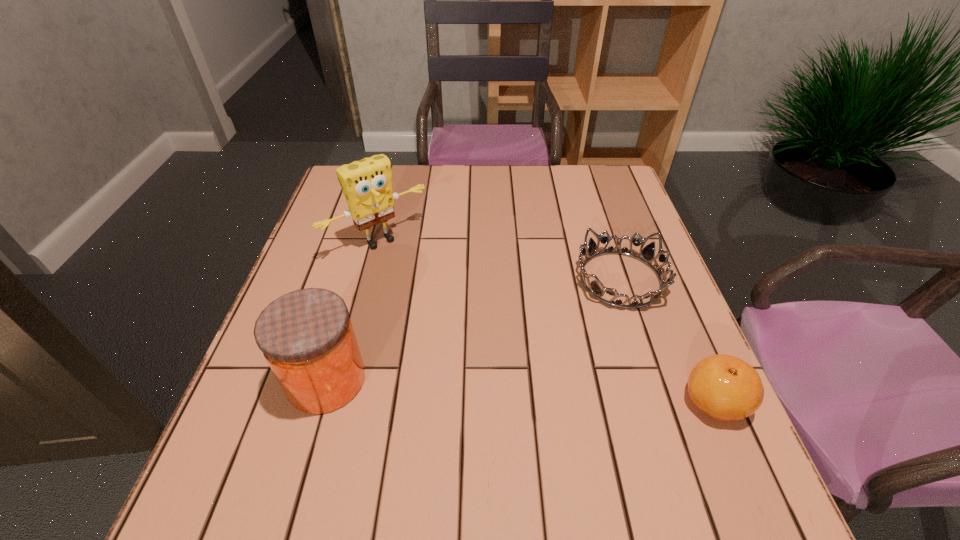
Locate an element on the screen. Image resolution: width=960 pixels, height=540 pixels. vacant area at the far edge of the desktop is located at coordinates (541, 184).

In the image, there is a desktop. Find the location of `free space at the near edge`. free space at the near edge is located at coordinates (409, 449).

At what (x,y) coordinates should I click in order to perform the action: click on vacant space at the left edge of the desktop. Please return your answer as a coordinate pair (x, y). Image resolution: width=960 pixels, height=540 pixels. Looking at the image, I should click on (331, 259).

Where is `free space at the right edge of the desktop`? This screenshot has height=540, width=960. free space at the right edge of the desktop is located at coordinates (680, 399).

Where is `blank space at the near right corner`? blank space at the near right corner is located at coordinates (676, 447).

The image size is (960, 540). I want to click on unoccupied position between the jar and the tiara, so click(473, 329).

I want to click on free space between the sponge and the tiara, so click(500, 260).

Where is `free space that is in between the jar and the clementine`? This screenshot has width=960, height=540. free space that is in between the jar and the clementine is located at coordinates tap(520, 390).

Where is `unoccupied position between the tiara and the tallest object`? Image resolution: width=960 pixels, height=540 pixels. unoccupied position between the tiara and the tallest object is located at coordinates (500, 260).

This screenshot has height=540, width=960. Find the location of `vacant point located between the tallest object and the clementine`. vacant point located between the tallest object and the clementine is located at coordinates (547, 321).